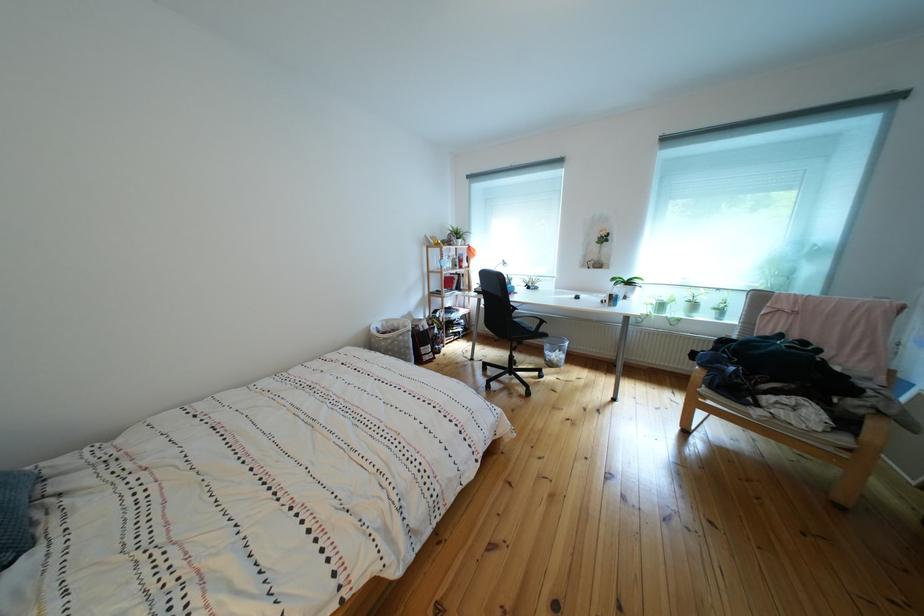
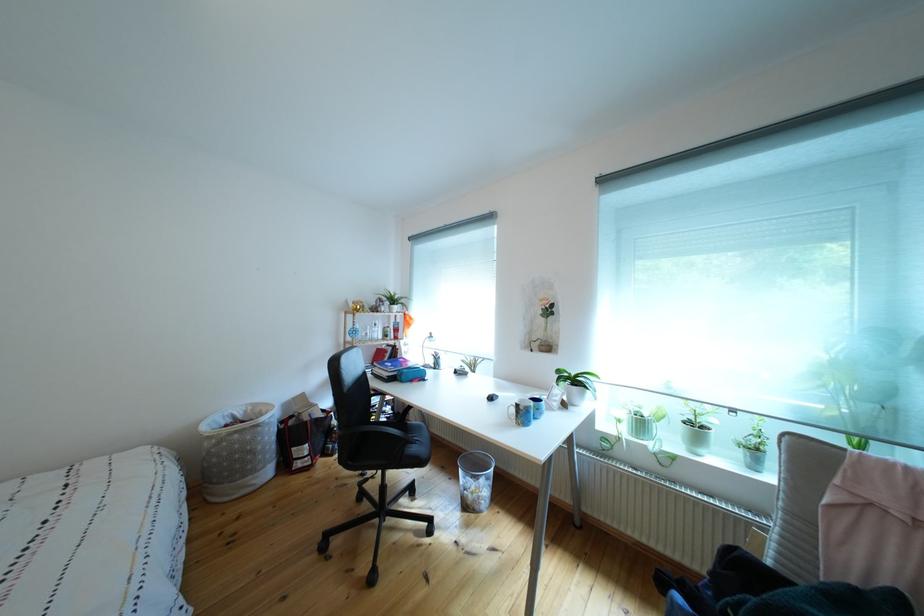
The point at [622,301] is marked in the first image. Where is the corresponding point in the second image?

(529, 411)